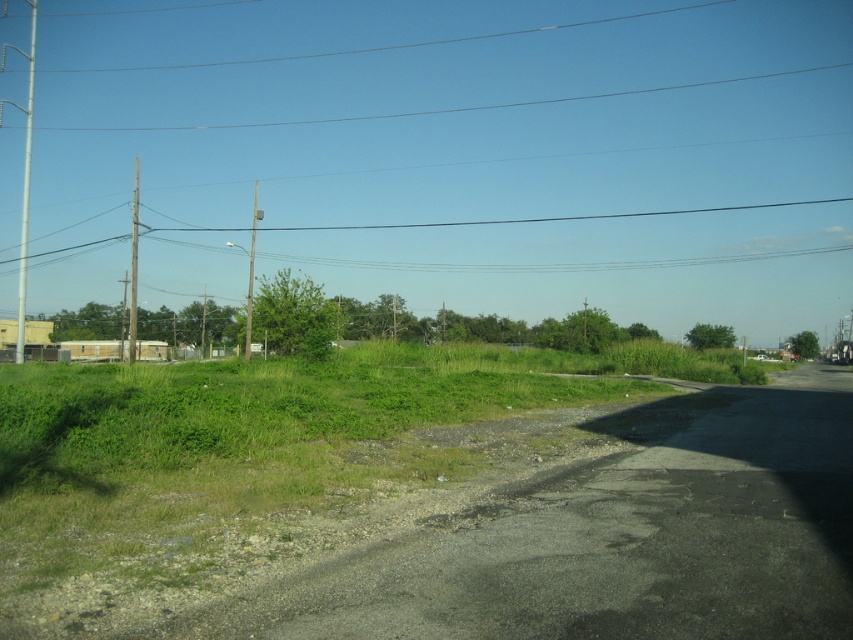
Question: Based on their relative distances, which object is nearer to the smooth gray pole at center?

Choices:
 (A) wooden telegraph pole at left
 (B) silver metallic pole at left
 (C) green grassy at lower left

Answer: (A)

Question: Can you confirm if green grassy at lower left is positioned to the right of silver metallic pole at left?

Choices:
 (A) no
 (B) yes

Answer: (B)

Question: Where is silver metallic pole at left located in relation to smooth gray pole at center in the image?

Choices:
 (A) below
 (B) above

Answer: (B)

Question: Which of the following is the closest to the observer?

Choices:
 (A) (254, 195)
 (B) (131, 356)
 (C) (19, 308)
 (D) (291, 474)

Answer: (D)

Question: Is silver metallic pole at left positioned at the back of smooth gray pole at center?

Choices:
 (A) yes
 (B) no

Answer: (B)

Question: Which point appears farthest from the camera in this image?

Choices:
 (A) (70, 433)
 (B) (28, 67)

Answer: (B)